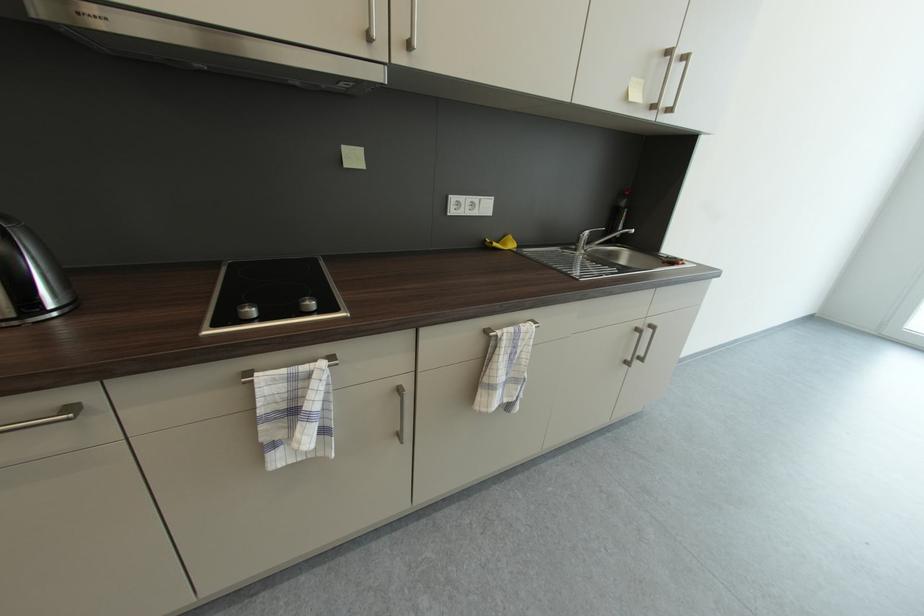
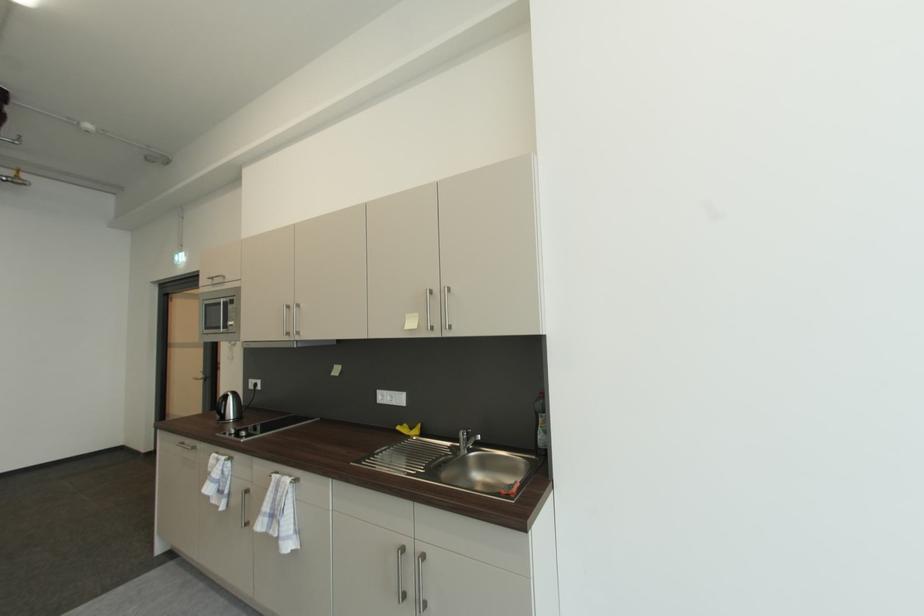
In the second image, find the point that corresponds to (265,413) in the first image.

(215, 471)